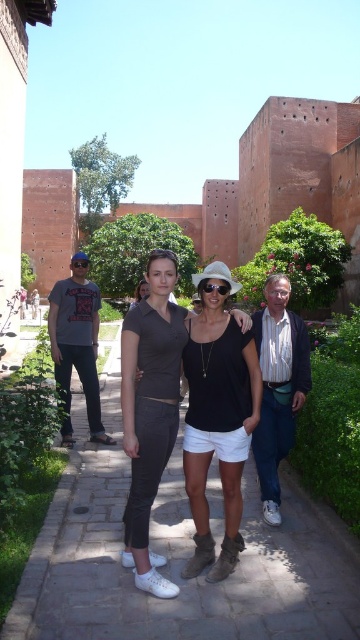
Question: Is matte gray dress at center thinner than white shirt at center?

Choices:
 (A) yes
 (B) no

Answer: (B)

Question: Among these objects, which one is nearest to the camera?

Choices:
 (A) paved stone path at center
 (B) matte gray dress at center
 (C) black plastic goggles at center
 (D) gray cotton t-shirt at left

Answer: (A)

Question: Which point is farther to the camera?

Choices:
 (A) paved stone path at center
 (B) matte gray dress at center

Answer: (B)

Question: Which of the following is the closest to the observer?

Choices:
 (A) paved stone path at center
 (B) white shirt at center

Answer: (A)

Question: Observing the image, what is the correct spatial positioning of matte gray dress at center in reference to white shirt at center?

Choices:
 (A) right
 (B) left

Answer: (B)

Question: Does paved stone path at center have a lesser width compared to matte gray dress at center?

Choices:
 (A) no
 (B) yes

Answer: (A)